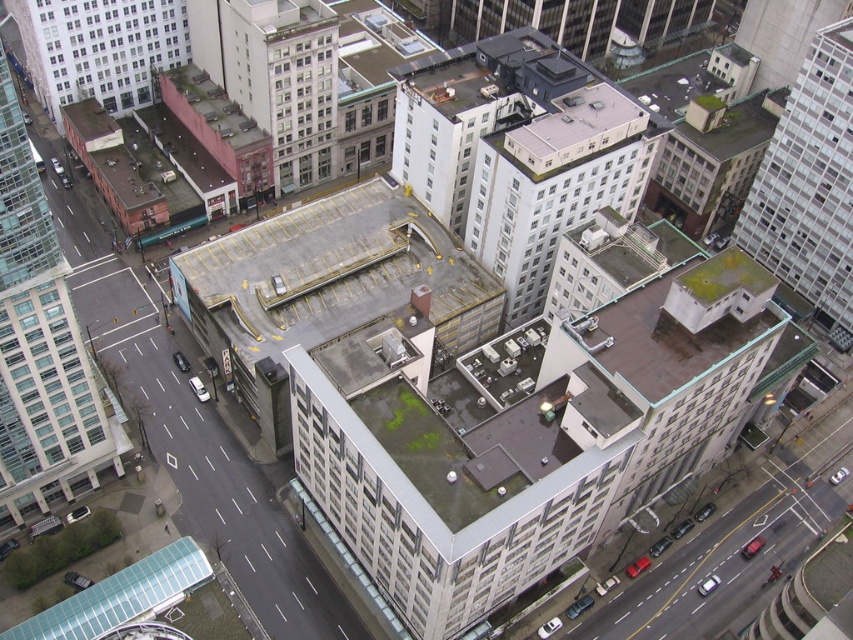
From the picture: You are a drone operator needing to fly a drone from the glassy white skyscraper at left to the white glass building at upper right. Based on the scene, can you determine if the flight path is clear vertically between these two buildings?

The glassy white skyscraper at left is below the white glass building at upper right, so the flight path between them is clear vertically as the drone can fly above the lower building.

You are a city planner reviewing this area and need to assess building sizes. Which of the two buildings, the white matte building at center or the white glass building at upper right, occupies more space in the image?

The white matte building at center has a larger size compared to the white glass building at upper right, so it occupies more space in the image.

You are a drone operator trying to locate the glassy white skyscraper at left in an aerial image. What are the coordinates where you should direct your drone to find it?

The glassy white skyscraper at left is located at coordinates point (41, 346).